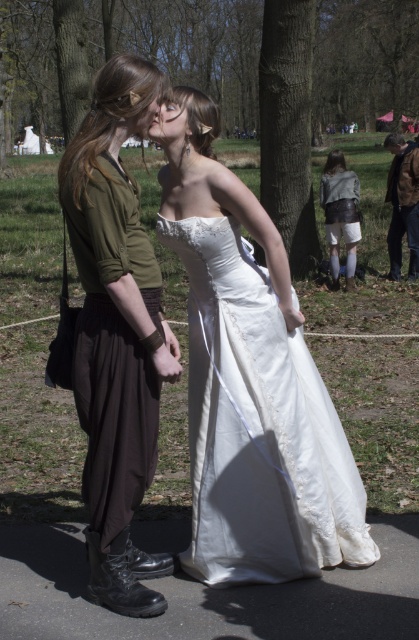
In the scene shown: You are a photographer positioned at the end of the path. You need to adjust your camera to focus on both the matte green shirt at center and the brown leather jacket at right. Which subject should you focus on first to ensure proper depth of field?

The matte green shirt at center is not as tall as the brown leather jacket at right, so you should focus on the brown leather jacket at right first as it is closer to the camera.

You are a photographer trying to capture a photo of the matte white dress at center and the brown leather jacket at right. Since you want to highlight the length of both items, which one should you focus on to ensure the full length is visible in the frame?

The matte white dress at center is shorter than the brown leather jacket at right, so focusing on the brown leather jacket at right will ensure its full length is visible since it is longer.

You are standing on the paved path in the park and see two points marked as point 1 at coordinates point (287, 573) and point 2 at coordinates point (413, 208). If you want to walk from point 1 to point 2, which direction should you move relative to your current position?

To move from point 1 at coordinates point (287, 573) to point 2 at coordinates point (413, 208), you should move backward since point 1 is in front of point 2 according to the spatial relationship provided.